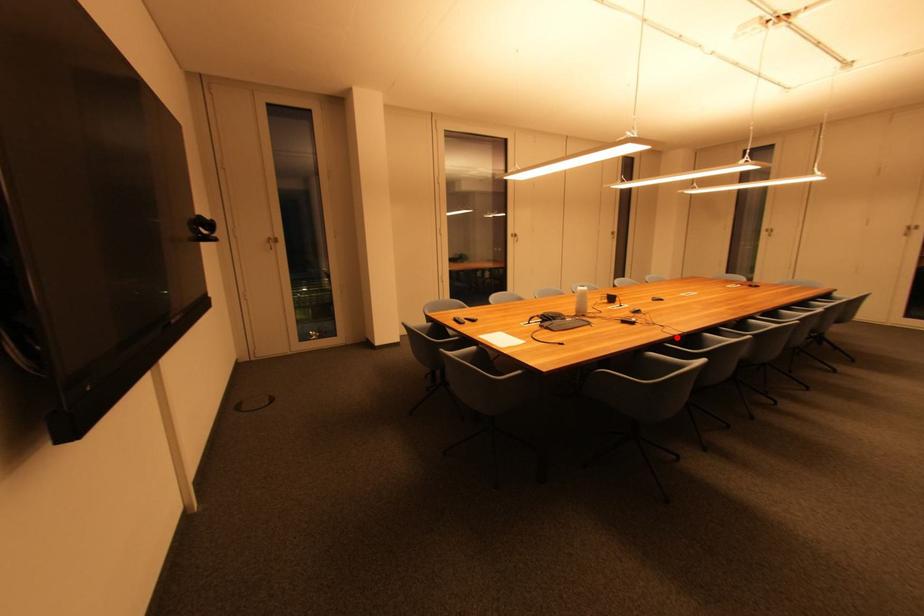
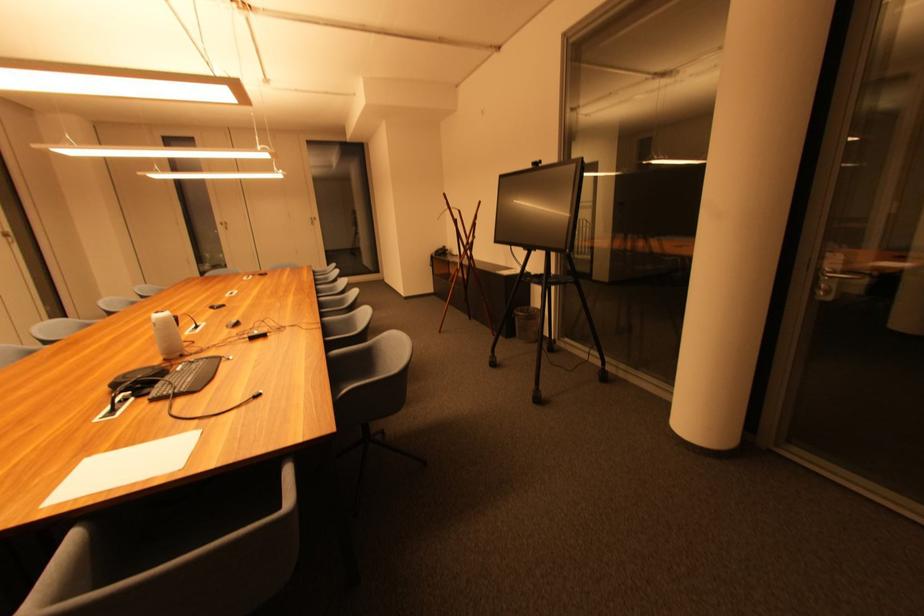
Locate, in the second image, the point that corresponds to the highlighted location in the first image.

(325, 331)